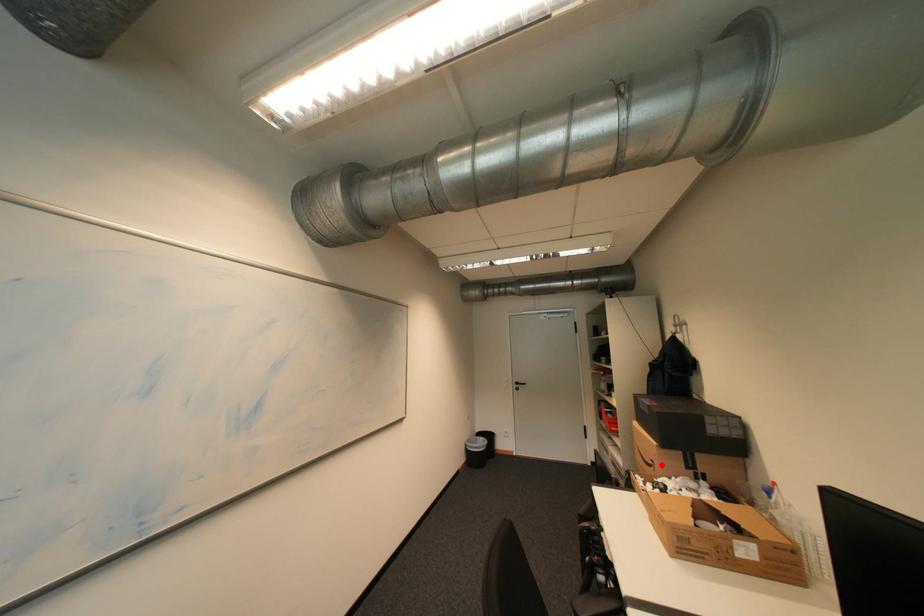
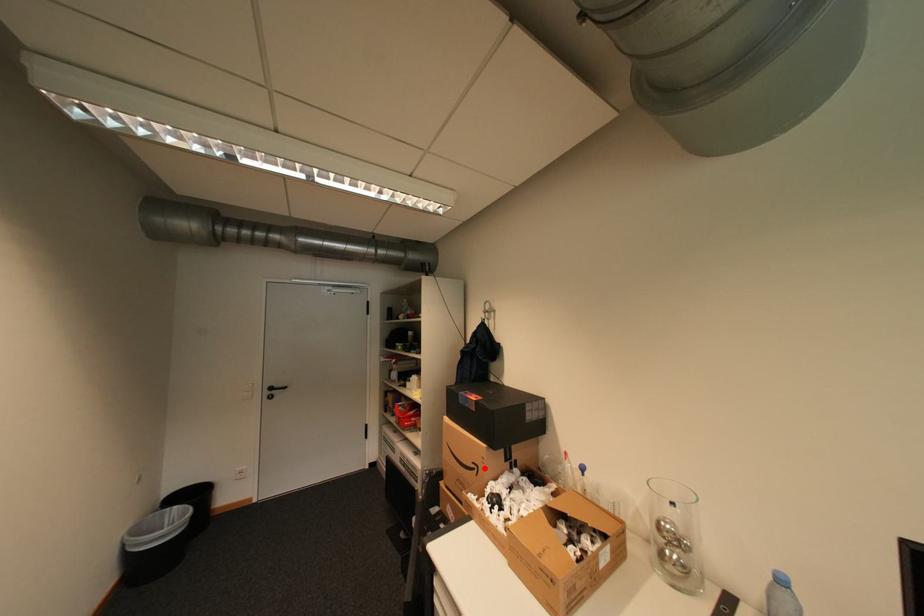
I am providing you with two images of the same scene from different viewpoints. A red point is marked on the first image and another point is marked on the second image. Does the point marked in image1 correspond to the same location as the one in image2?

Yes